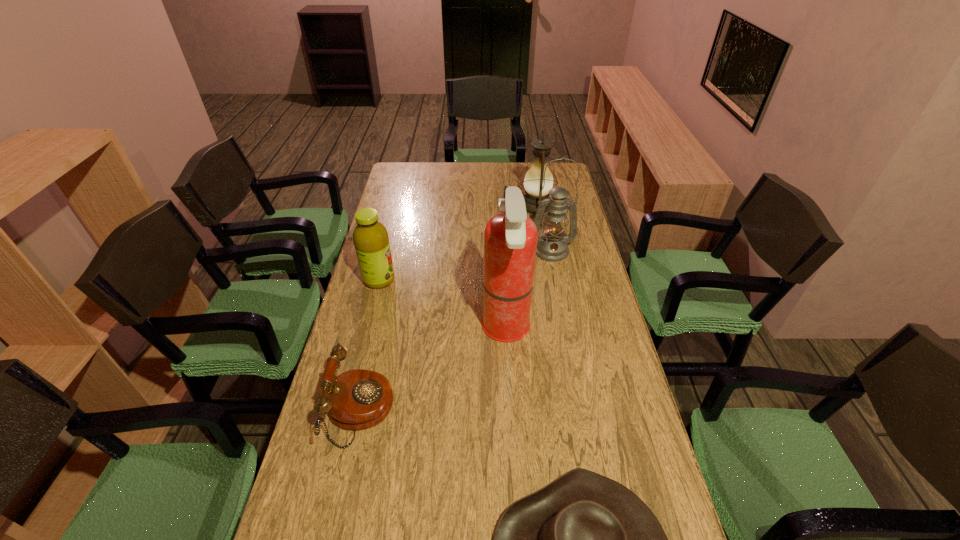
Find the location of a particular element. The image size is (960, 540). vacant space situated with the handle and hose on the third nearest object is located at coordinates (466, 329).

Where is `free space located on the back of the nearer oil lamp`? This screenshot has height=540, width=960. free space located on the back of the nearer oil lamp is located at coordinates (545, 217).

The height and width of the screenshot is (540, 960). Find the location of `vacant region located 0.170m on the front of the farther oil lamp`. vacant region located 0.170m on the front of the farther oil lamp is located at coordinates (542, 243).

You are a GUI agent. You are given a task and a screenshot of the screen. Output one action in this format:
    pyautogui.click(x=<x>, y=<y>)
    Task: Click on the blank space located on the front label of the third farthest object
    The width and height of the screenshot is (960, 540).
    Given the screenshot: What is the action you would take?
    pyautogui.click(x=493, y=280)

The height and width of the screenshot is (540, 960). Find the location of `vacant area situated on the dial of the fifth farthest object`. vacant area situated on the dial of the fifth farthest object is located at coordinates (421, 411).

Locate an element on the screen. Image resolution: width=960 pixels, height=540 pixels. fruit juice at the left edge is located at coordinates (370, 237).

Locate an element on the screen. The width and height of the screenshot is (960, 540). telephone that is positioned at the left edge is located at coordinates (357, 399).

In the image, there is a desktop. At what (x,y) coordinates should I click in order to perform the action: click on vacant space at the far edge. Please return your answer as a coordinate pair (x, y). This screenshot has height=540, width=960. Looking at the image, I should click on (510, 163).

Locate an element on the screen. free region at the left edge of the desktop is located at coordinates (398, 292).

This screenshot has width=960, height=540. Find the location of `vacant space at the right edge of the desktop`. vacant space at the right edge of the desktop is located at coordinates (579, 286).